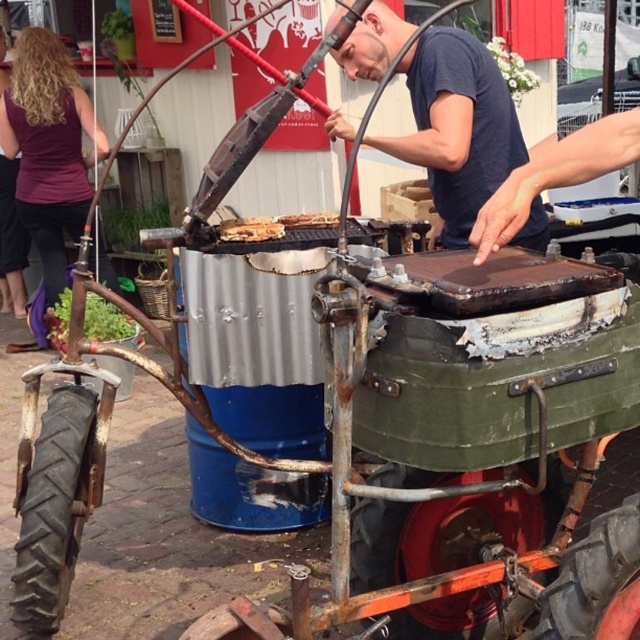
You are setting up a cooking station and have both the brown wooden plank at center and the brown matte grill at center. Which object should you place first if you need to ensure there is enough space for both?

The brown wooden plank at center is bigger than the brown matte grill at center, so you should place the brown wooden plank at center first to ensure there is enough space for both.

You are a customer at the street food market and want to find the purple fabric at left. Where should you look relative to the grill?

The purple fabric at left is located at point 0.231 on the horizontal axis and 0.078 on the vertical axis relative to the grill.